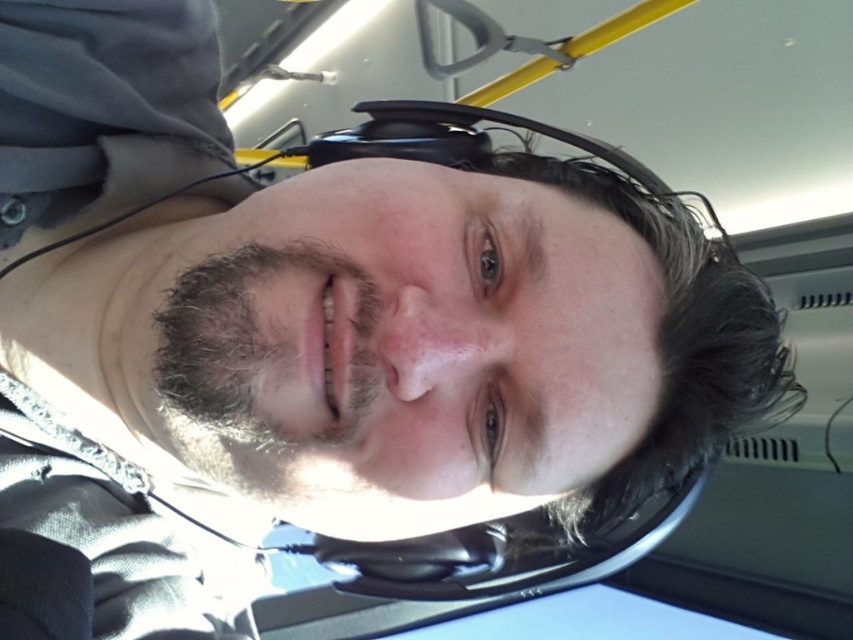
Does black matte view mirror at center appear under dark brown curly hair at lower left?

Yes.

Does black matte view mirror at center have a smaller size compared to dark brown curly hair at lower left?

Incorrect, black matte view mirror at center is not smaller in size than dark brown curly hair at lower left.

Between point (451, 116) and point (341, 272), which one is positioned behind?

Positioned behind is point (451, 116).

This screenshot has width=853, height=640. I want to click on black matte view mirror at center, so click(498, 554).